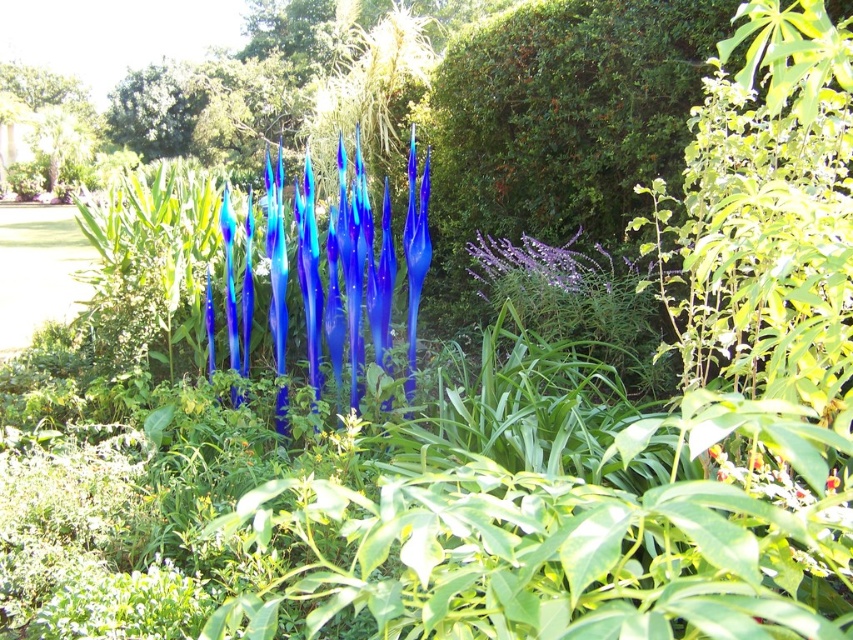
Question: Which point is closer to the camera taking this photo?

Choices:
 (A) (515, 264)
 (B) (328, 248)

Answer: (B)

Question: Can you confirm if glossy glass spikes at center is thinner than purple matte flower at center-right?

Choices:
 (A) yes
 (B) no

Answer: (B)

Question: Does glossy glass spikes at center appear on the right side of purple matte flower at center-right?

Choices:
 (A) yes
 (B) no

Answer: (B)

Question: Is glossy glass spikes at center further to camera compared to purple matte flower at center-right?

Choices:
 (A) yes
 (B) no

Answer: (B)

Question: Which point is closer to the camera?

Choices:
 (A) (341, 198)
 (B) (596, 250)

Answer: (A)